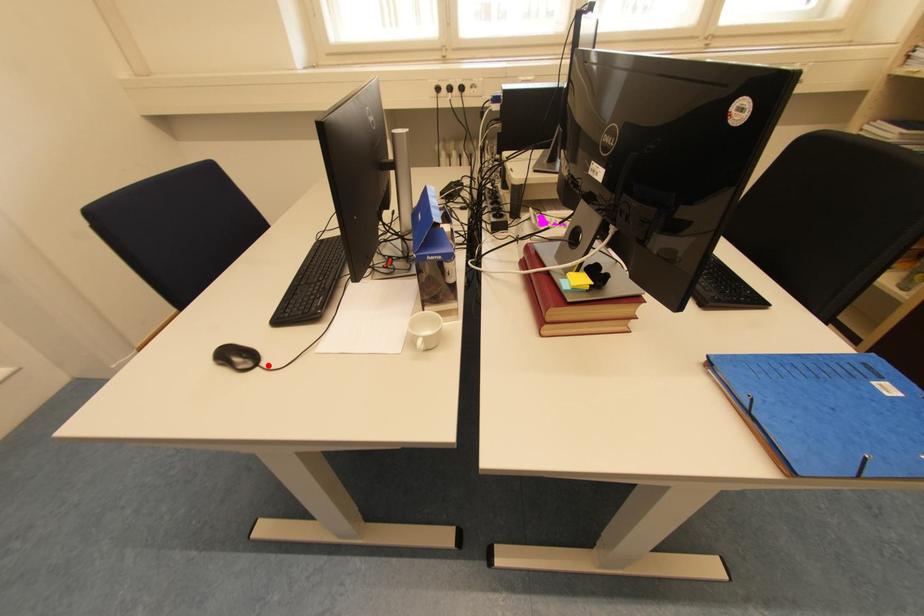
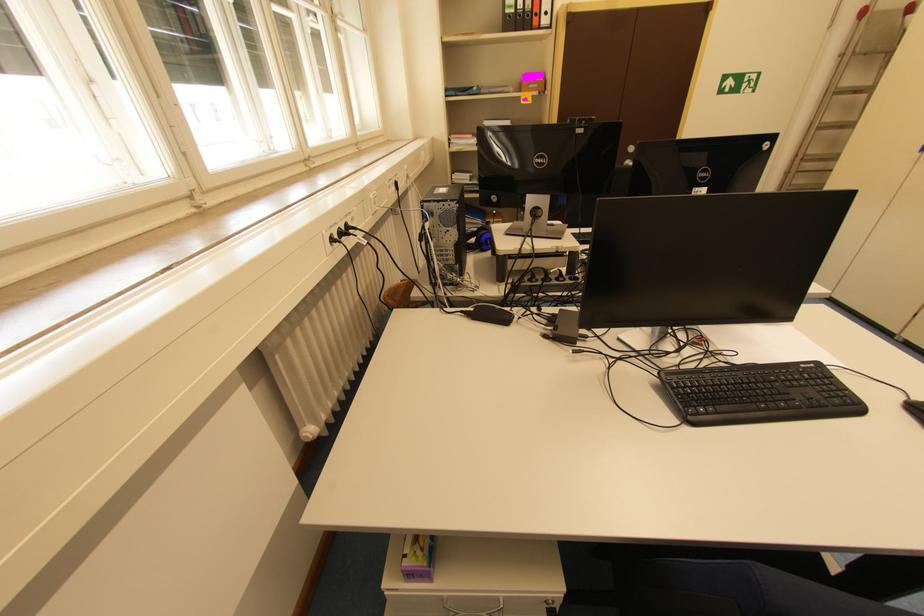
Question: I am providing you with two images of the same scene from different viewpoints. A red point is shown in image1. For the corresponding object point in image2, is it positioned nearer or farther from the camera?

Choices:
 (A) Nearer
 (B) Farther

Answer: (A)